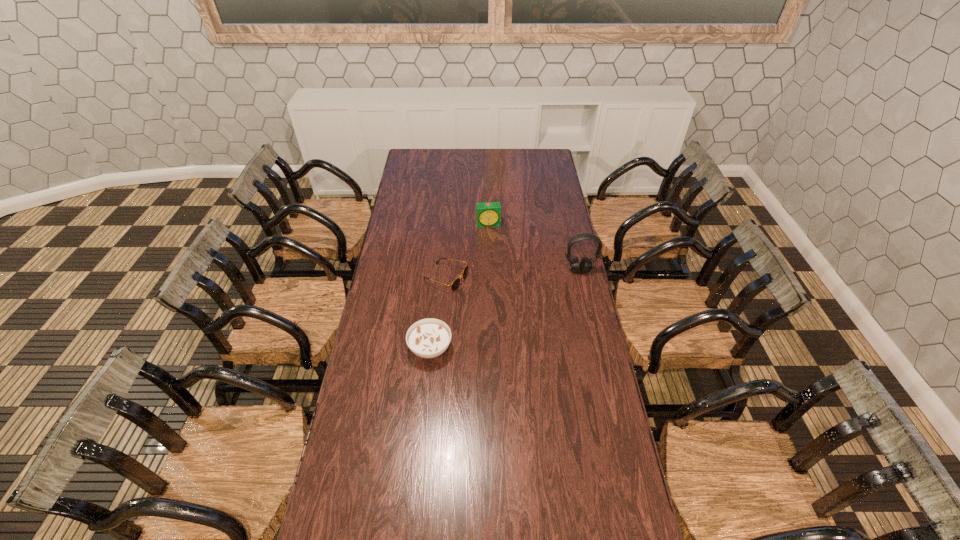
The height and width of the screenshot is (540, 960). What are the coordinates of `free space on the desktop that is between the nearest object and the tallest object and is positioned on the lenses of the shortest object` in the screenshot? It's located at (515, 305).

At what (x,y) coordinates should I click in order to perform the action: click on vacant space on the desktop that is between the soup bowl and the rightmost object and is positioned on the front-facing side of the farthest object. Please return your answer as a coordinate pair (x, y). The height and width of the screenshot is (540, 960). Looking at the image, I should click on click(502, 311).